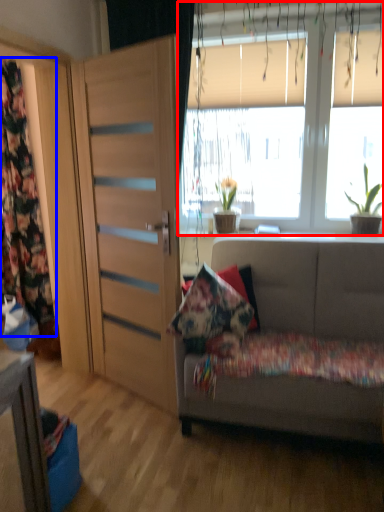
Question: Which of the following is the closest to the observer, window (highlighted by a red box) or curtain (highlighted by a blue box)?

Choices:
 (A) window
 (B) curtain

Answer: (A)